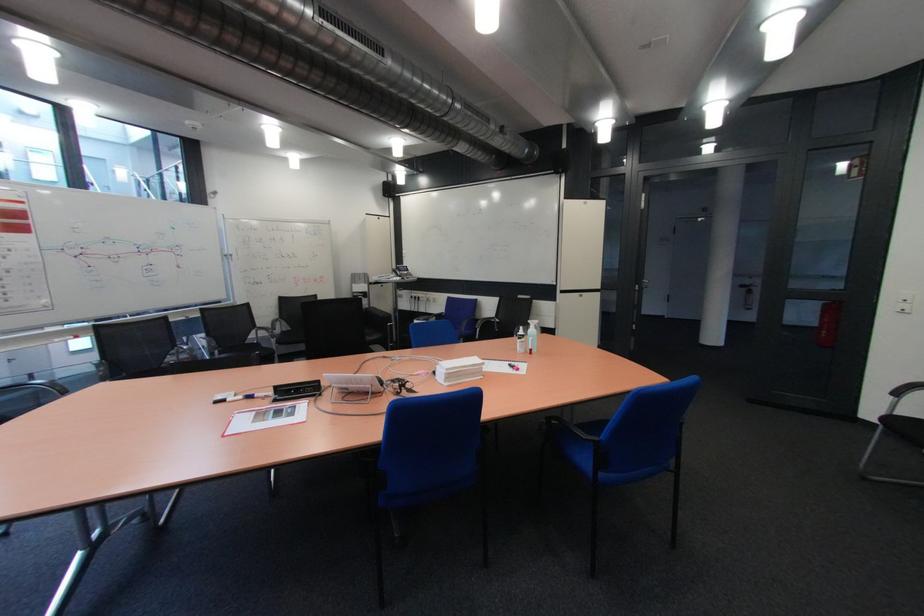
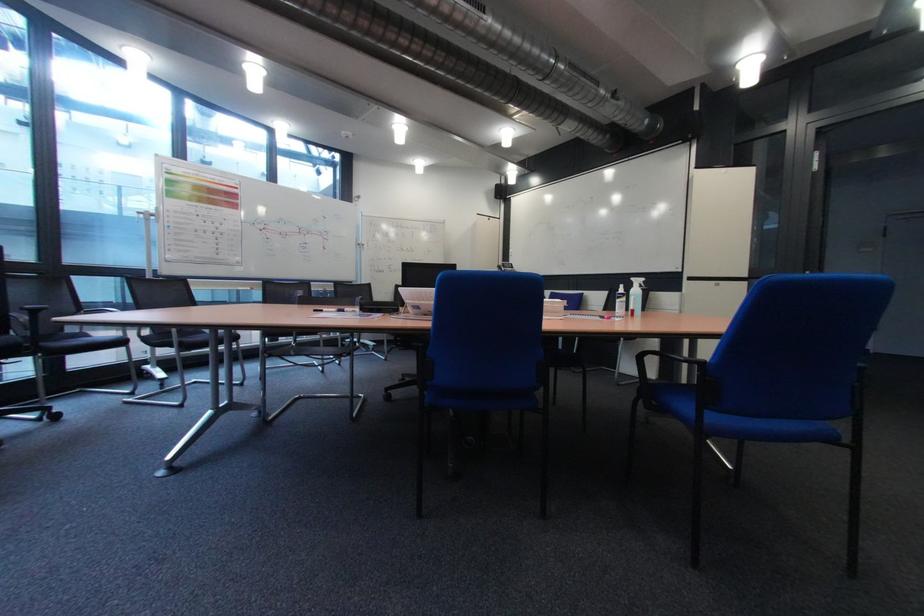
Which direction would the cameraman need to move to produce the second image?

The movement direction of the cameraman is right, forward.